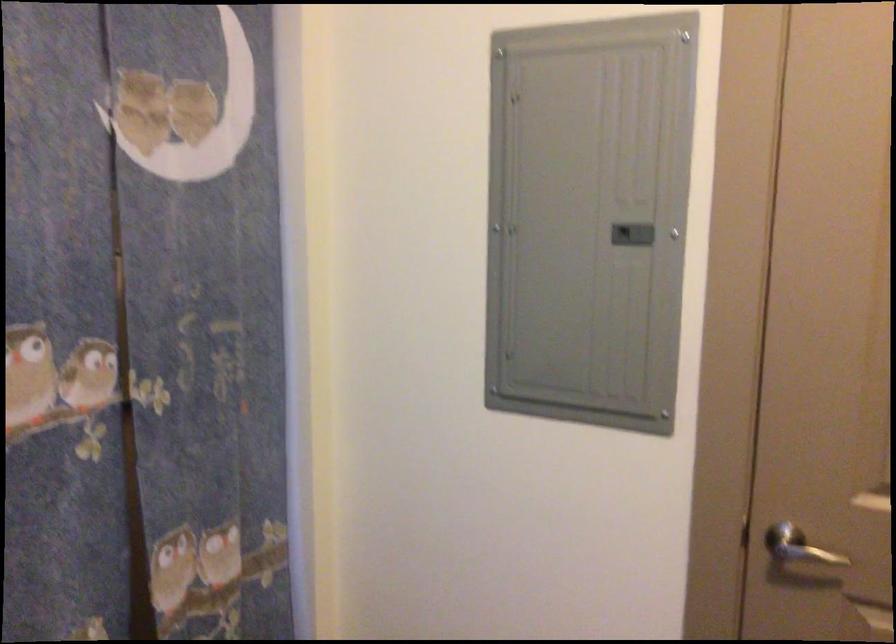
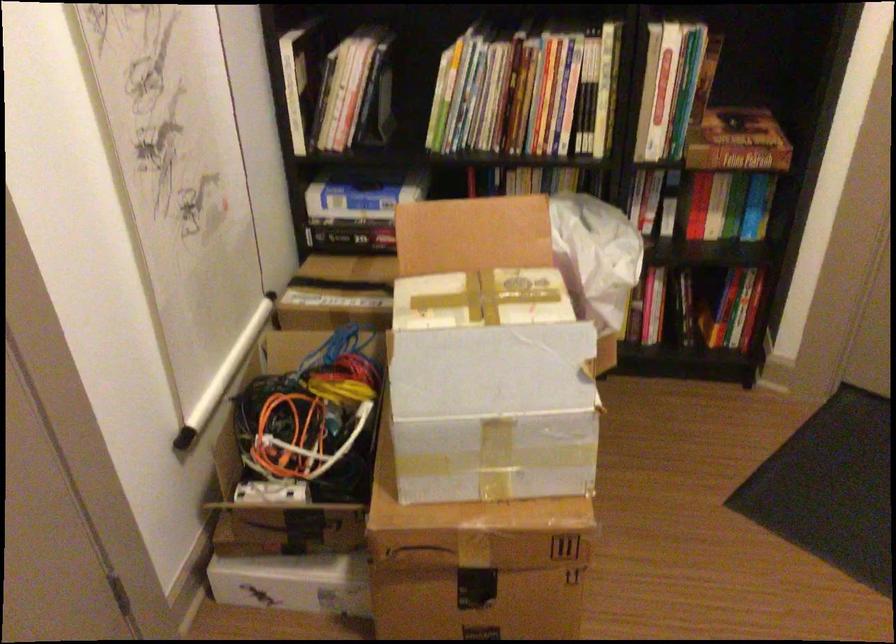
The images are taken continuously from a first-person perspective. In which direction is your viewpoint rotating?

The rotation direction of the camera is right-down.